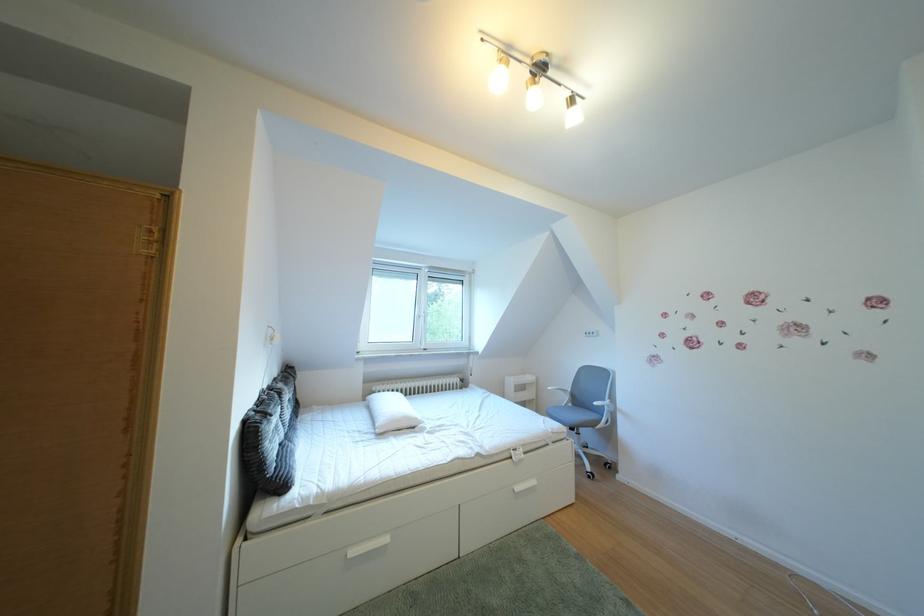
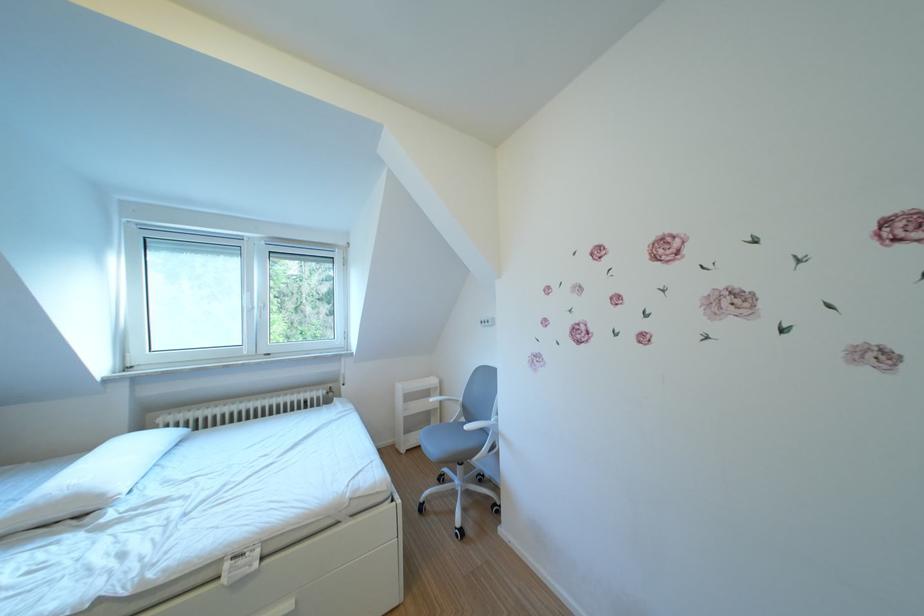
In the second image, find the point that corresponds to point (430, 424) in the first image.

(115, 501)